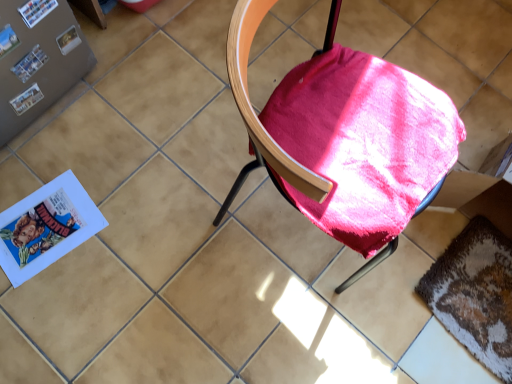
Locate an element on the screen. free space to the back side of velvet-like pink cushion at center is located at coordinates (321, 44).